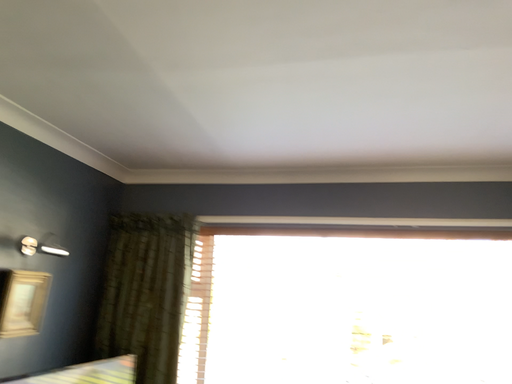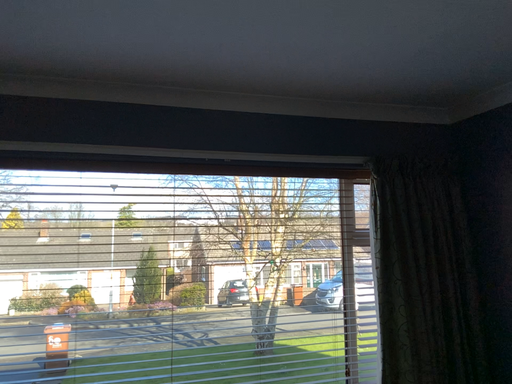
Question: Which way did the camera rotate in the video?

Choices:
 (A) rotated left
 (B) rotated right

Answer: (B)